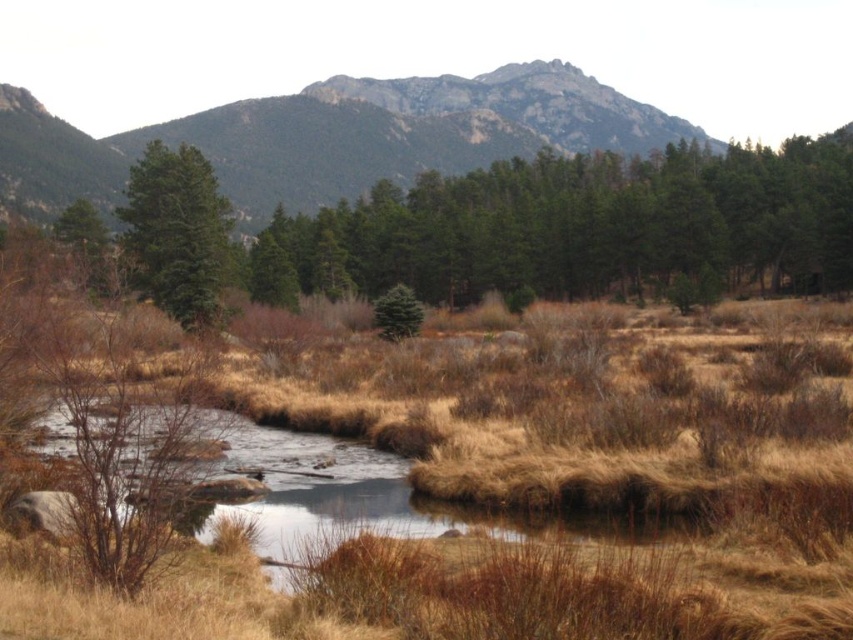
Question: Is gray rocky mountain at upper center wider than green matte tree at left?

Choices:
 (A) yes
 (B) no

Answer: (A)

Question: Which point is farther from the camera taking this photo?

Choices:
 (A) (70, 625)
 (B) (521, 192)
 (C) (387, 314)

Answer: (B)

Question: From the image, what is the correct spatial relationship of brown dry grass at center in relation to gray rocky mountain at upper center?

Choices:
 (A) right
 (B) left

Answer: (A)

Question: Is green textured trees at center above gray rocky mountain at upper center?

Choices:
 (A) yes
 (B) no

Answer: (B)

Question: Estimate the real-world distances between objects in this image. Which object is farther from the green textured trees at center?

Choices:
 (A) green matte evergreen tree at center
 (B) brown dry grass at center

Answer: (B)

Question: Among these objects, which one is nearest to the camera?

Choices:
 (A) green matte tree at left
 (B) green textured trees at center

Answer: (A)